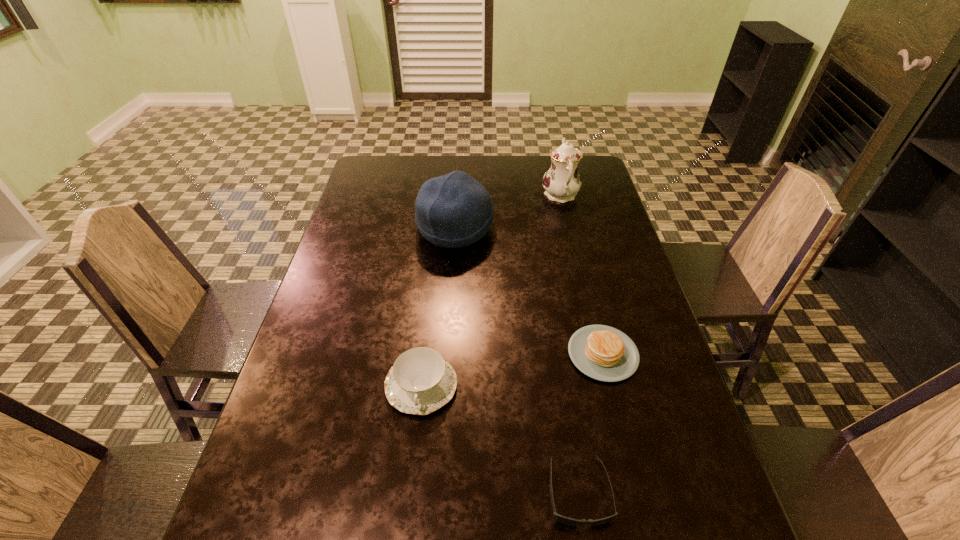
Find the location of a particular element. The image size is (960, 540). vacant space located 0.050m on the handle side of the nearer chinaware is located at coordinates (415, 440).

Where is `free spot located 0.310m on the front of the fourth tallest object`? The image size is (960, 540). free spot located 0.310m on the front of the fourth tallest object is located at coordinates (646, 533).

Where is `object that is positioned at the far edge`? The width and height of the screenshot is (960, 540). object that is positioned at the far edge is located at coordinates (562, 182).

This screenshot has height=540, width=960. In order to click on chinaware present at the right edge in this screenshot , I will do `click(562, 182)`.

Find the location of a particular element. Image resolution: width=960 pixels, height=540 pixels. pancake present at the right edge is located at coordinates (604, 353).

You are a GUI agent. You are given a task and a screenshot of the screen. Output one action in this format:
    pyautogui.click(x=<x>, y=<y>)
    Task: Click on the object located in the far right corner section of the desktop
    This screenshot has width=960, height=540.
    Given the screenshot: What is the action you would take?
    pyautogui.click(x=562, y=182)

Identify the location of vacant space at the left edge. (315, 323).

Where is `vacant space at the right edge of the desktop`? The height and width of the screenshot is (540, 960). vacant space at the right edge of the desktop is located at coordinates (594, 231).

Identify the location of vacant space at the far left corner of the desktop. Image resolution: width=960 pixels, height=540 pixels. (378, 173).

Identify the location of vacant area that lies between the right chinaware and the fourth tallest object. This screenshot has width=960, height=540. (582, 274).